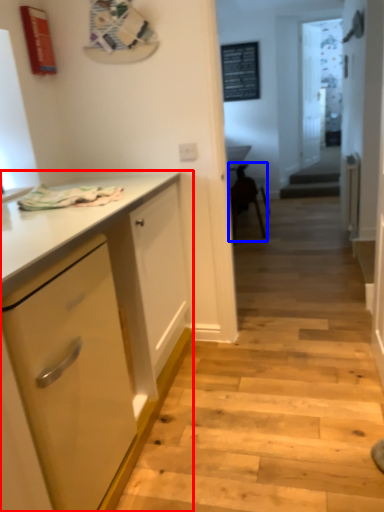
Question: Which of the following is the farthest to the observer, cabinetry (highlighted by a red box) or chair (highlighted by a blue box)?

Choices:
 (A) cabinetry
 (B) chair

Answer: (B)